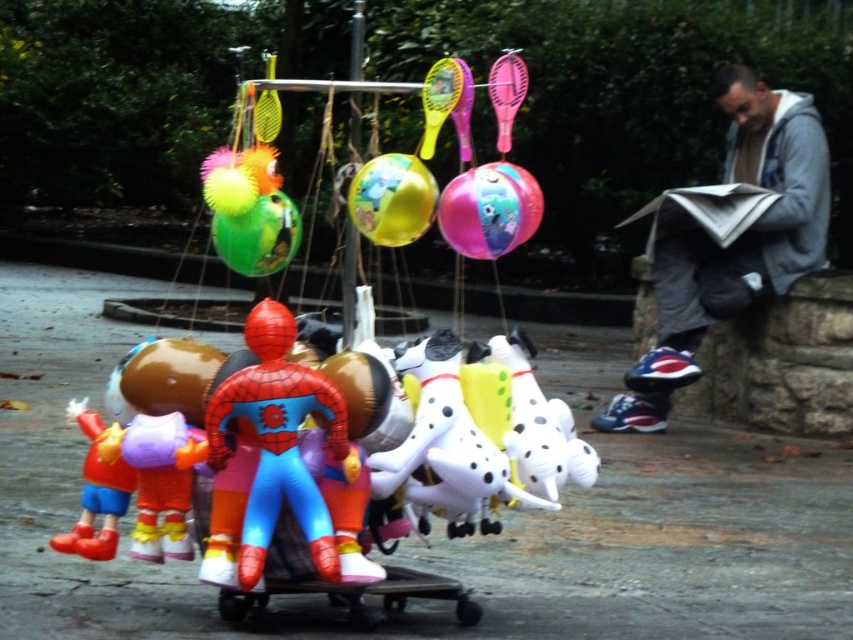
Question: Does glossy pink balloon at center have a larger size compared to rubber clown at center?

Choices:
 (A) yes
 (B) no

Answer: (B)

Question: Is gray hoodie at upper right wider than glossy pink balloon at center?

Choices:
 (A) yes
 (B) no

Answer: (A)

Question: Estimate the real-world distances between objects in this image. Which object is farther from the glossy pink balloon at center?

Choices:
 (A) shiny metallic balloon at center
 (B) shiny plastic inflatable at center
 (C) translucent green balloon at center

Answer: (B)

Question: Is shiny metallic balloon at center wider than rubber clown at center?

Choices:
 (A) no
 (B) yes

Answer: (A)

Question: Which point is farther to the camera?

Choices:
 (A) translucent green balloon at center
 (B) glossy pink balloon at center

Answer: (B)

Question: Which point is closer to the camera taking this photo?

Choices:
 (A) (114, 515)
 (B) (490, 204)
 (C) (263, 244)
 (D) (387, 240)

Answer: (B)